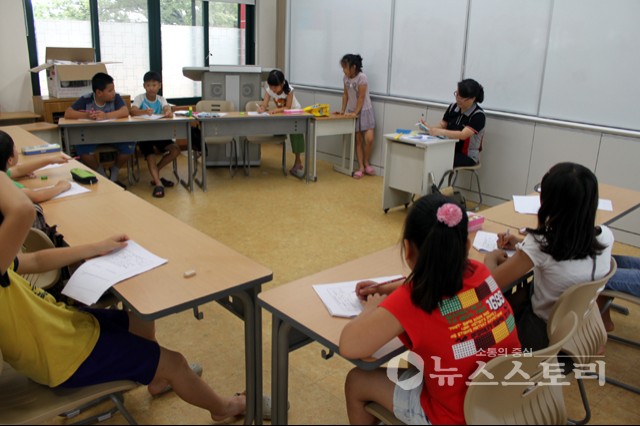
Locate an element on the screen. This screenshot has height=426, width=640. floor is located at coordinates (273, 238).